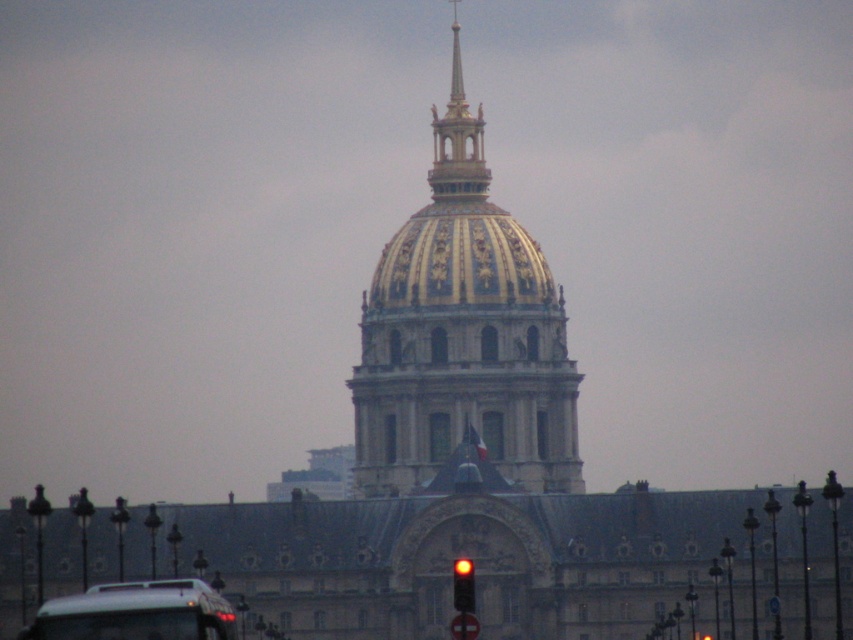
How distant is gold/gilded dome at center from white matte bus at lower left?

gold/gilded dome at center is 45.79 meters away from white matte bus at lower left.

Does gold/gilded dome at center have a greater height compared to white matte bus at lower left?

Correct, gold/gilded dome at center is much taller as white matte bus at lower left.

Find the location of a particular element. Image resolution: width=853 pixels, height=640 pixels. gold/gilded dome at center is located at coordinates (462, 333).

Does white matte bus at lower left appear on the left side of red glass traffic light at center?

Yes, white matte bus at lower left is to the left of red glass traffic light at center.

Is white matte bus at lower left positioned before red glass traffic light at center?

That is True.

Is point (108, 605) more distant than point (465, 566)?

No, it is in front of (465, 566).

Image resolution: width=853 pixels, height=640 pixels. In order to click on white matte bus at lower left in this screenshot , I will do `click(136, 612)`.

Which is more to the right, gold/gilded dome at center or red glass traffic light at center?

red glass traffic light at center is more to the right.

Can you confirm if gold/gilded dome at center is positioned to the right of red glass traffic light at center?

No, gold/gilded dome at center is not to the right of red glass traffic light at center.

Describe the element at coordinates (462, 333) in the screenshot. I see `gold/gilded dome at center` at that location.

Locate an element on the screen. gold/gilded dome at center is located at coordinates (462, 333).